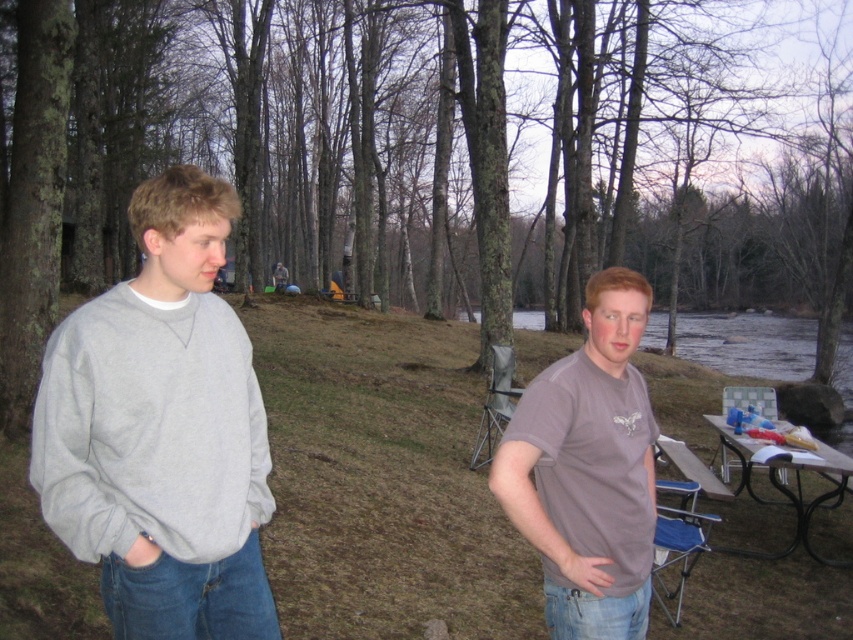
Question: Which of the following is the closest to the observer?

Choices:
 (A) metallic silver picnic table at lower right
 (B) gray heathered sweatshirt at left

Answer: (B)

Question: Which object is closer to the camera taking this photo?

Choices:
 (A) gray heathered sweatshirt at left
 (B) metallic silver picnic table at lower right
 (C) matte gray t-shirt at center

Answer: (A)

Question: Does gray heathered sweatshirt at left lie behind metallic silver picnic table at lower right?

Choices:
 (A) yes
 (B) no

Answer: (B)

Question: Is gray heathered sweatshirt at left bigger than metallic silver picnic table at lower right?

Choices:
 (A) yes
 (B) no

Answer: (B)

Question: Is matte gray t-shirt at center positioned at the back of metallic silver picnic table at lower right?

Choices:
 (A) no
 (B) yes

Answer: (A)

Question: Which object is closer to the camera taking this photo?

Choices:
 (A) matte gray t-shirt at center
 (B) gray heathered sweatshirt at left

Answer: (B)